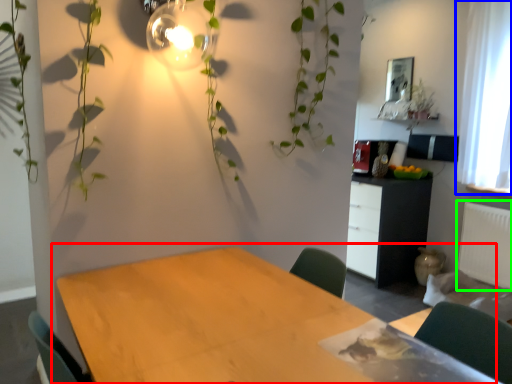
Question: Which object is positioned farthest from table (highlighted by a red box)? Select from curtain (highlighted by a blue box) and radiator (highlighted by a green box).

Choices:
 (A) curtain
 (B) radiator

Answer: (A)